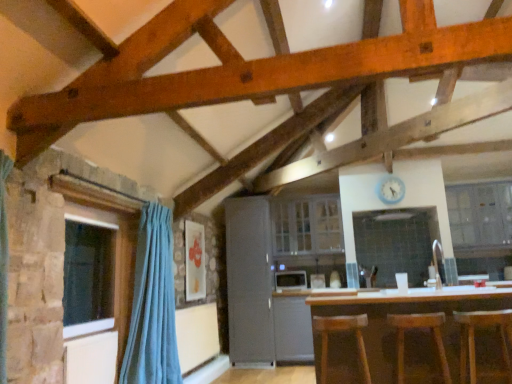
Question: Is wooden bar stool at center, placed as the 1th bar stool when sorted from left to right, positioned before white glossy cabinet at upper center, marked as the 1th cabinetry in a right-to-left arrangement?

Choices:
 (A) no
 (B) yes

Answer: (B)

Question: From a real-world perspective, is wooden bar stool at center, the third bar stool from the right, on white glossy cabinet at upper center, marked as the 1th cabinetry in a right-to-left arrangement?

Choices:
 (A) yes
 (B) no

Answer: (B)

Question: Considering the relative sizes of wooden bar stool at center, placed as the 1th bar stool when sorted from left to right, and white glossy cabinet at upper center, the 2th cabinetry in the left-to-right sequence, in the image provided, is wooden bar stool at center, placed as the 1th bar stool when sorted from left to right, shorter than white glossy cabinet at upper center, the 2th cabinetry in the left-to-right sequence,?

Choices:
 (A) yes
 (B) no

Answer: (A)

Question: From the image's perspective, is wooden bar stool at center, placed as the 1th bar stool when sorted from left to right, located above white glossy cabinet at upper center, marked as the 1th cabinetry in a right-to-left arrangement?

Choices:
 (A) yes
 (B) no

Answer: (B)

Question: From the image's perspective, does wooden bar stool at center, the third bar stool from the right, appear lower than white glossy cabinet at upper center, marked as the 1th cabinetry in a right-to-left arrangement?

Choices:
 (A) yes
 (B) no

Answer: (A)

Question: Is white glossy sink at center inside the boundaries of white glossy cabinet at upper center, marked as the 1th cabinetry in a right-to-left arrangement, or outside?

Choices:
 (A) outside
 (B) inside

Answer: (A)

Question: Based on their positions, is white glossy sink at center located to the left or right of white glossy cabinet at upper center, the 2th cabinetry in the left-to-right sequence?

Choices:
 (A) right
 (B) left

Answer: (B)

Question: Looking at the image, does white glossy sink at center seem bigger or smaller compared to white glossy cabinet at upper center, the 2th cabinetry in the left-to-right sequence?

Choices:
 (A) big
 (B) small

Answer: (B)

Question: Considering the positions of white glossy sink at center and white glossy cabinet at upper center, the 2th cabinetry in the left-to-right sequence, in the image, is white glossy sink at center wider or thinner than white glossy cabinet at upper center, the 2th cabinetry in the left-to-right sequence,?

Choices:
 (A) wide
 (B) thin

Answer: (A)

Question: From a real-world perspective, is brown wooden table at center positioned above or below clear glass window at left?

Choices:
 (A) below
 (B) above

Answer: (A)

Question: From the image's perspective, is brown wooden table at center located above or below clear glass window at left?

Choices:
 (A) below
 (B) above

Answer: (A)

Question: Looking at their shapes, would you say brown wooden table at center is wider or thinner than clear glass window at left?

Choices:
 (A) wide
 (B) thin

Answer: (A)

Question: Based on their positions, is brown wooden table at center located to the left or right of clear glass window at left?

Choices:
 (A) left
 (B) right

Answer: (B)

Question: In the image, is white glossy cabinet at center, which is the 2th cabinetry in right-to-left order, on the left side or the right side of teal fabric curtain at left?

Choices:
 (A) right
 (B) left

Answer: (A)

Question: Do you think white glossy cabinet at center, which is the first cabinetry in left-to-right order, is within teal fabric curtain at left, or outside of it?

Choices:
 (A) outside
 (B) inside

Answer: (A)